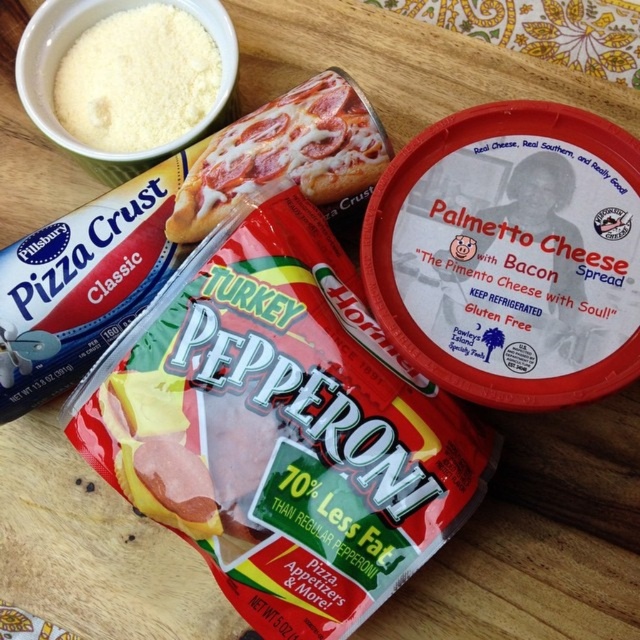
You are a chef preparing a dish and see the shiny metallic pizza at center and the white powder at upper left on the wooden surface. Which object takes up more horizontal space?

The shiny metallic pizza at center has a greater width than the white powder at upper left, so it takes up more horizontal space.

You are a chef preparing a pizza and see the shiny metallic pizza at center and the white powder at upper left. Which ingredient is closer to the right side of the workspace?

The shiny metallic pizza at center is positioned on the right side of the white powder at upper left, so it is closer to the right side of the workspace.

You are preparing a pizza and see the shiny metallic pizza at center and the white powder at upper left. Where is the white powder located in relation to the pizza?

The white powder at upper left is above the shiny metallic pizza at center.